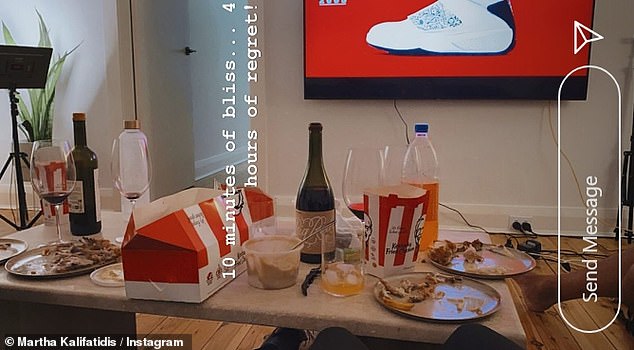
Identify the location of green plant. (42, 110).